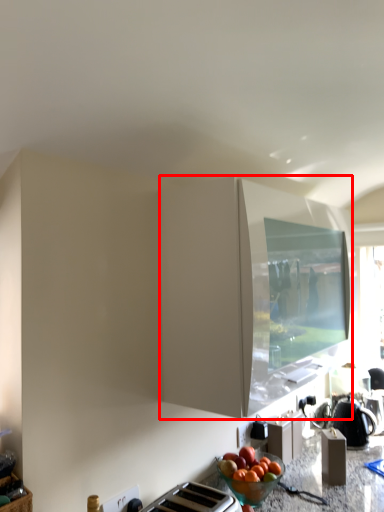
Question: Considering the relative positions of cabinetry (annotated by the red box) and kettle in the image provided, where is cabinetry (annotated by the red box) located with respect to the staircase?

Choices:
 (A) right
 (B) left

Answer: (B)